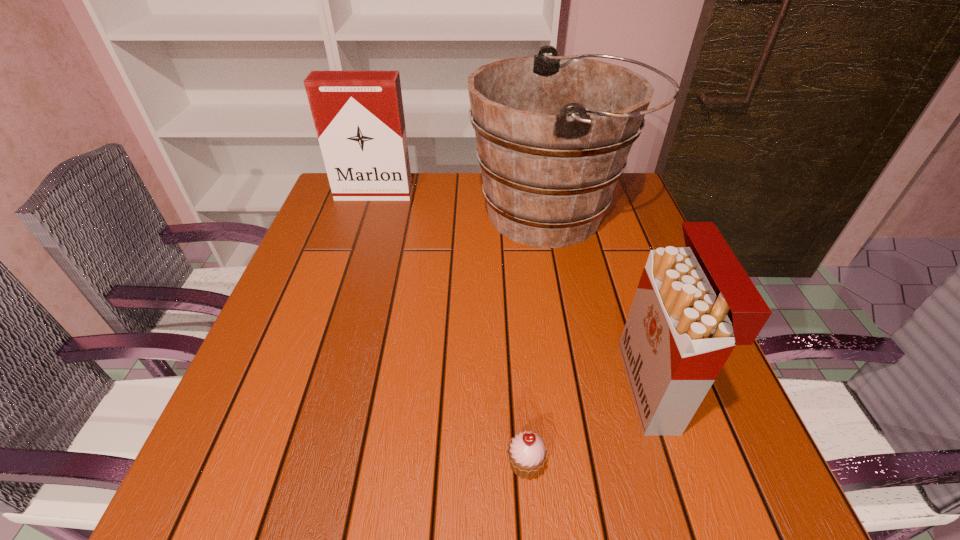
Identify the location of bucket. This screenshot has height=540, width=960. coord(553,133).

The width and height of the screenshot is (960, 540). What are the coordinates of `the farther cigarette case` in the screenshot? It's located at (359, 118).

The height and width of the screenshot is (540, 960). In order to click on the left cigarette case in this screenshot , I will do `click(359, 118)`.

Locate an element on the screen. The width and height of the screenshot is (960, 540). the second nearest object is located at coordinates (694, 304).

The image size is (960, 540). Identify the location of the right cigarette case. (694, 304).

This screenshot has height=540, width=960. I want to click on cupcake, so click(x=526, y=452).

Find the location of a particular element. The height and width of the screenshot is (540, 960). the shortest object is located at coordinates (526, 452).

Where is `vacant space located 0.140m on the front-facing side of the leftmost object`? This screenshot has height=540, width=960. vacant space located 0.140m on the front-facing side of the leftmost object is located at coordinates (362, 231).

I want to click on vacant space situated 0.300m with the lid open on the nearer cigarette case, so click(466, 387).

Locate an element on the screen. The image size is (960, 540). vacant space situated 0.390m with the lid open on the nearer cigarette case is located at coordinates (417, 387).